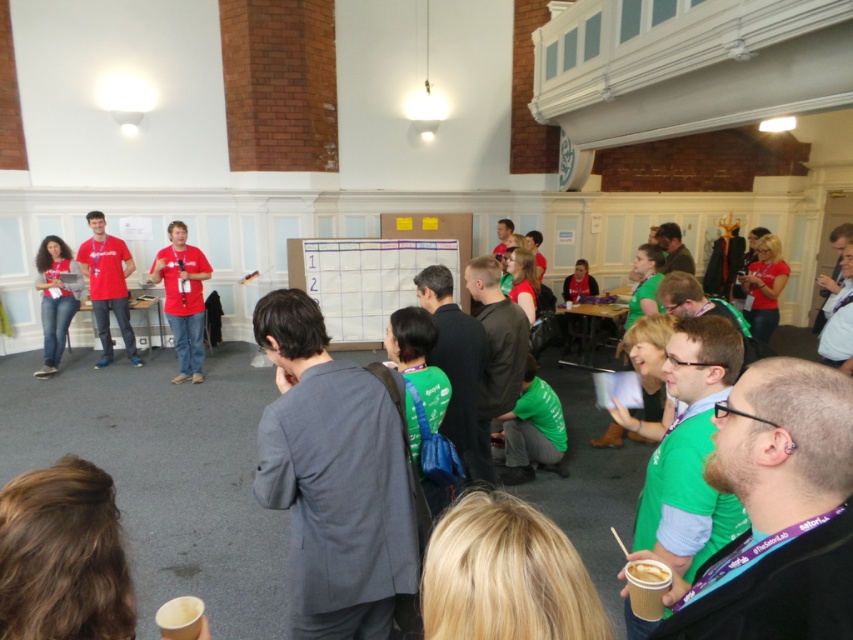
Question: Does matte red shirt at left have a lesser width compared to jeans at left?

Choices:
 (A) no
 (B) yes

Answer: (A)

Question: Which of the following is the farthest from the observer?

Choices:
 (A) (195, 339)
 (B) (105, 282)
 (C) (39, 372)

Answer: (B)

Question: Among these objects, which one is nearest to the camera?

Choices:
 (A) matte red shirt at left
 (B) matte red shirt at center
 (C) jeans at left

Answer: (B)

Question: Which object appears farthest from the camera in this image?

Choices:
 (A) matte red shirt at left
 (B) matte red shirt at center

Answer: (A)

Question: Does matte red shirt at center appear on the right side of jeans at left?

Choices:
 (A) yes
 (B) no

Answer: (A)

Question: Is the position of matte red shirt at center less distant than that of jeans at left?

Choices:
 (A) no
 (B) yes

Answer: (B)